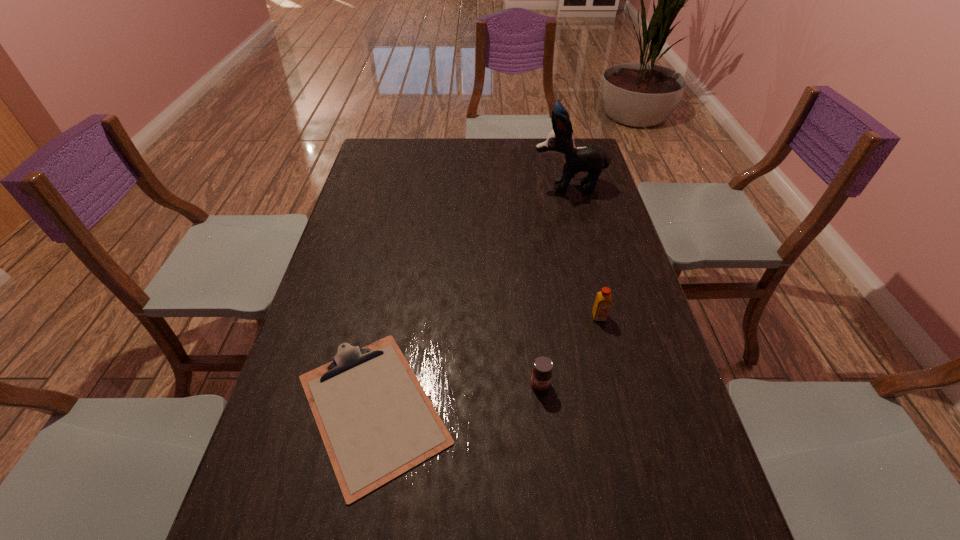
At what (x,y) coordinates should I click in order to perform the action: click on vacant space that's between the clipboard and the second farthest object. Please return your answer as a coordinate pair (x, y). Looking at the image, I should click on (x=486, y=362).

Locate which object is the closest to the third tallest object. Please provide its 2D coordinates. Your answer should be formatted as a tuple, i.e. [(x, y)], where the tuple contains the x and y coordinates of a point satisfying the conditions above.

[(376, 421)]

Point out which object is positioned as the third nearest to the jam. Please provide its 2D coordinates. Your answer should be formatted as a tuple, i.e. [(x, y)], where the tuple contains the x and y coordinates of a point satisfying the conditions above.

[(590, 158)]

Identify the location of vacant space that satisfies the following two spatial constraints: 1. on the front-facing side of the tallest object; 2. on the label side of the second object from left to right. (619, 384).

You are a GUI agent. You are given a task and a screenshot of the screen. Output one action in this format:
    pyautogui.click(x=<x>, y=<y>)
    Task: Click on the vacant position in the image that satisfies the following two spatial constraints: 1. on the front-facing side of the puppy; 2. on the front and back of the second tallest object
    The width and height of the screenshot is (960, 540).
    Given the screenshot: What is the action you would take?
    pyautogui.click(x=602, y=316)

Where is `free spot that satisfies the following two spatial constraints: 1. on the front-facing side of the puppy; 2. on the front side of the shortest object`? This screenshot has width=960, height=540. free spot that satisfies the following two spatial constraints: 1. on the front-facing side of the puppy; 2. on the front side of the shortest object is located at coordinates (625, 408).